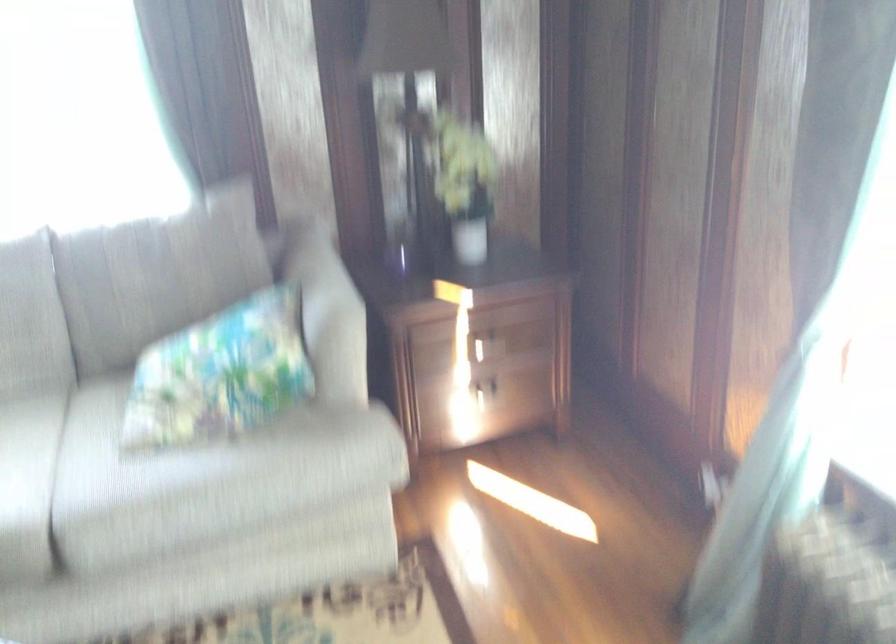
Describe the element at coordinates (464, 184) in the screenshot. The image size is (896, 644). I see `the white flower pot` at that location.